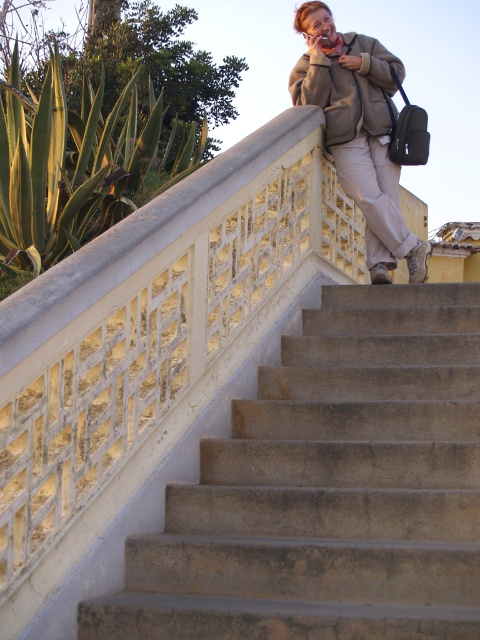
Question: Which of the following is the closest to the observer?

Choices:
 (A) (358, 145)
 (B) (469, 429)

Answer: (B)

Question: Which of the following is the farthest from the observer?

Choices:
 (A) (375, 99)
 (B) (458, 596)

Answer: (A)

Question: Can you confirm if concrete stairs at center is positioned below matte beige pants at upper center?

Choices:
 (A) yes
 (B) no

Answer: (A)

Question: Does concrete stairs at center have a larger size compared to matte beige pants at upper center?

Choices:
 (A) yes
 (B) no

Answer: (A)

Question: Considering the relative positions of concrete stairs at center and matte beige pants at upper center in the image provided, where is concrete stairs at center located with respect to matte beige pants at upper center?

Choices:
 (A) below
 (B) above

Answer: (A)